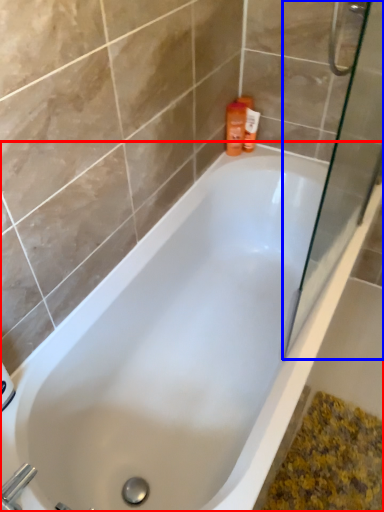
Question: Among these objects, which one is farthest to the camera, bathtub (highlighted by a red box) or screen door (highlighted by a blue box)?

Choices:
 (A) bathtub
 (B) screen door

Answer: (A)